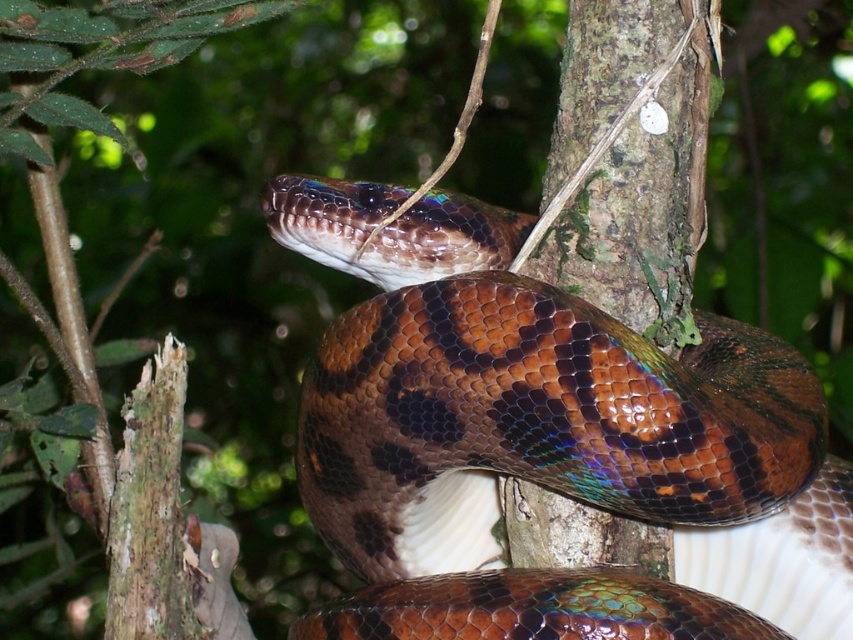
You are a photographer trying to capture the snake in the forest. You notice two points on the snake, one at point (763, 372) and the other at point (601, 35). Which point will appear larger in your photo?

Point (763, 372) is closer to the camera than point (601, 35), so it will appear larger in the photo.

You are a wildlife photographer aiming to capture the shiny brown snake at center. Based on its position in the image, which part of the tree trunk would you focus on to ensure the snake is in sharp focus?

The shiny brown snake at center is located at point (547, 442), so you should focus on that specific coordinate on the tree trunk to ensure the snake is in sharp focus.

You are a hiker in the forest and you see the shiny brown snake at center and the green mossy bark at center. Which object takes up more space in the image?

The shiny brown snake at center is bigger than the green mossy bark at center, so it takes up more space in the image.